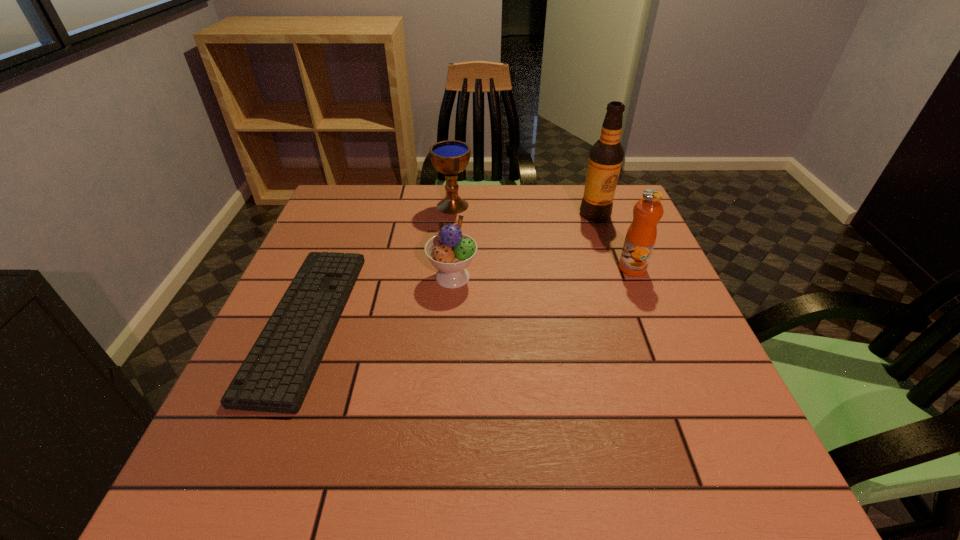
At what (x,y) coordinates should I click in order to perform the action: click on the tallest object. Please return your answer as a coordinate pair (x, y). The width and height of the screenshot is (960, 540). Looking at the image, I should click on (605, 159).

The height and width of the screenshot is (540, 960). I want to click on fruit juice, so click(x=641, y=235).

Where is `chalice`? This screenshot has height=540, width=960. chalice is located at coordinates (450, 157).

The height and width of the screenshot is (540, 960). I want to click on the fourth tallest object, so click(450, 251).

Where is `the leftmost object`? the leftmost object is located at coordinates (277, 373).

Identify the location of computer keyboard. This screenshot has height=540, width=960. (277, 373).

This screenshot has height=540, width=960. I want to click on vacant space situated on the label of the tallest object, so click(606, 245).

Identify the location of free space located on the front of the fruit juice. The width and height of the screenshot is (960, 540). (678, 380).

You are a GUI agent. You are given a task and a screenshot of the screen. Output one action in this format:
    pyautogui.click(x=<x>, y=<y>)
    Task: Click on the vacant region located on the left of the chalice
    
    Given the screenshot: What is the action you would take?
    pyautogui.click(x=410, y=206)

You are a GUI agent. You are given a task and a screenshot of the screen. Output one action in this format:
    pyautogui.click(x=<x>, y=<y>)
    Task: Click on the free space located 0.210m on the front of the icecream
    
    Given the screenshot: What is the action you would take?
    pyautogui.click(x=446, y=368)